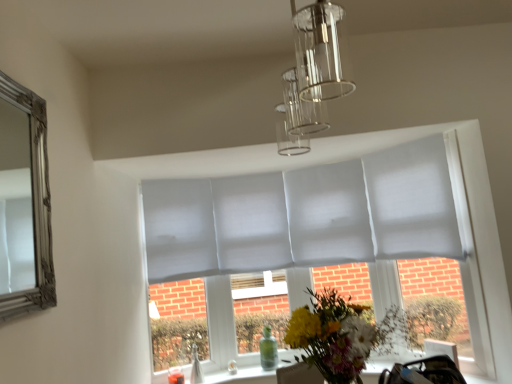
Question: Does clear glass vase at lower center, which ranks as the 1th glass vase in front-to-back order, lie behind transparent glass vase at lower center, which is the 1th glass vase in right-to-left order?

Choices:
 (A) yes
 (B) no

Answer: (B)

Question: From the image's perspective, is clear glass vase at lower center, the 2th glass vase viewed from the right, under transparent glass vase at lower center, arranged as the 2th glass vase when viewed from the front?

Choices:
 (A) yes
 (B) no

Answer: (A)

Question: Is clear glass vase at lower center, the 2th glass vase viewed from the right, at the right side of transparent glass vase at lower center, the 2th glass vase viewed from the left?

Choices:
 (A) no
 (B) yes

Answer: (A)

Question: Is clear glass vase at lower center, the 2th glass vase viewed from the right, smaller than transparent glass vase at lower center, arranged as the 2th glass vase when viewed from the front?

Choices:
 (A) yes
 (B) no

Answer: (A)

Question: Does clear glass vase at lower center, which ranks as the 1th glass vase in front-to-back order, have a greater height compared to transparent glass vase at lower center, the 2th glass vase viewed from the left?

Choices:
 (A) yes
 (B) no

Answer: (B)

Question: Is clear glass chandelier at upper center situated inside fluffy bouquet at center or outside?

Choices:
 (A) outside
 (B) inside

Answer: (A)

Question: In terms of size, does clear glass chandelier at upper center appear bigger or smaller than fluffy bouquet at center?

Choices:
 (A) big
 (B) small

Answer: (A)

Question: Considering the positions of clear glass chandelier at upper center and fluffy bouquet at center in the image, is clear glass chandelier at upper center taller or shorter than fluffy bouquet at center?

Choices:
 (A) short
 (B) tall

Answer: (B)

Question: From the image's perspective, is clear glass chandelier at upper center above or below fluffy bouquet at center?

Choices:
 (A) below
 (B) above

Answer: (B)

Question: From the image's perspective, is clear glass vase at lower center, arranged as the 1th glass vase when viewed from the left, above or below clear glass chandelier at upper center?

Choices:
 (A) below
 (B) above

Answer: (A)

Question: Considering the positions of point click(x=197, y=347) and point click(x=287, y=72), is point click(x=197, y=347) closer or farther from the camera than point click(x=287, y=72)?

Choices:
 (A) closer
 (B) farther

Answer: (B)

Question: From a real-world perspective, is clear glass vase at lower center, which ranks as the 1th glass vase in front-to-back order, above or below clear glass chandelier at upper center?

Choices:
 (A) below
 (B) above

Answer: (A)

Question: Is clear glass vase at lower center, marked as the second glass vase in a back-to-front arrangement, inside or outside of clear glass chandelier at upper center?

Choices:
 (A) inside
 (B) outside

Answer: (B)

Question: Looking at their shapes, would you say clear glass vase at lower center, the 2th glass vase viewed from the right, is wider or thinner than fluffy bouquet at center?

Choices:
 (A) wide
 (B) thin

Answer: (B)

Question: From a real-world perspective, is clear glass vase at lower center, which ranks as the 1th glass vase in front-to-back order, physically located above or below fluffy bouquet at center?

Choices:
 (A) above
 (B) below

Answer: (B)